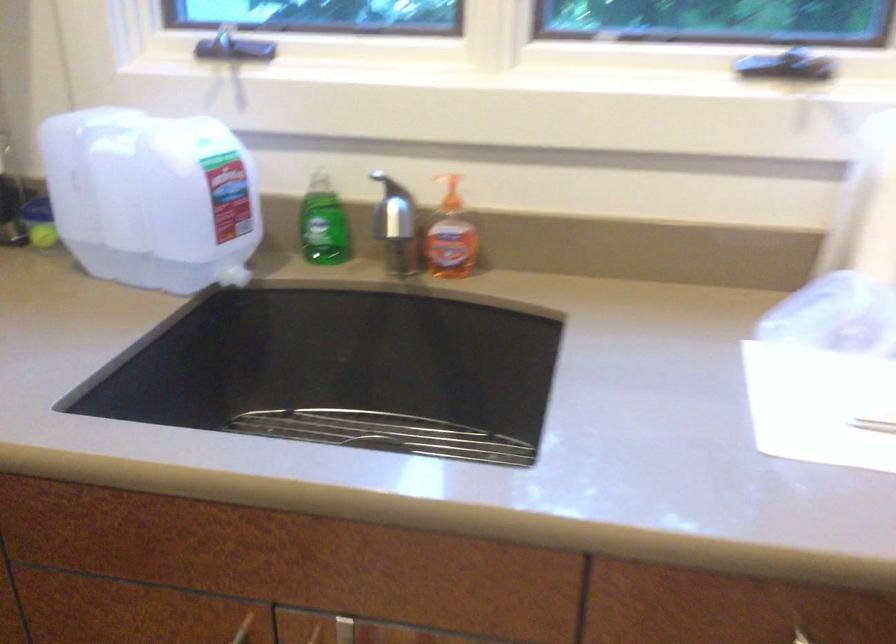
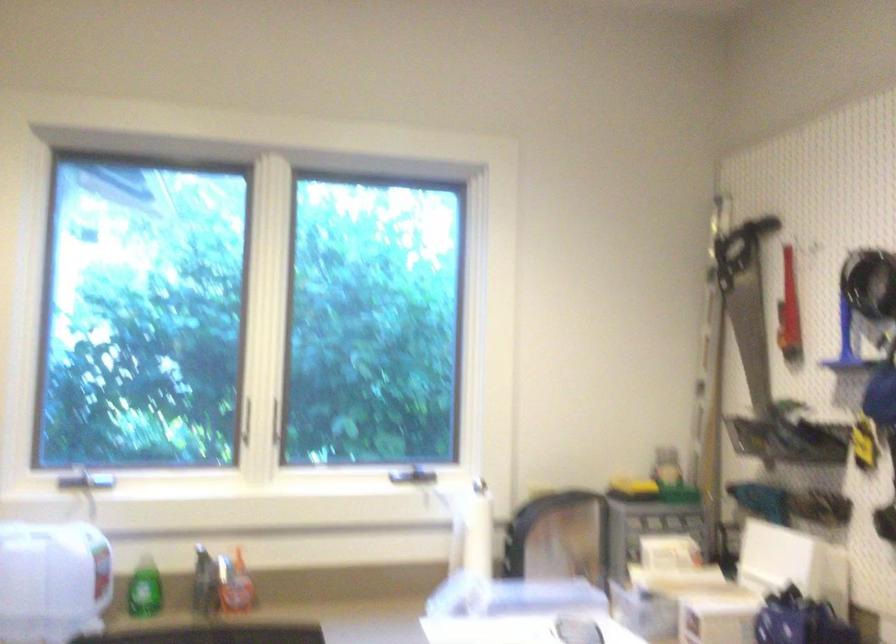
In the second image, find the point that corresponds to (444,234) in the first image.

(234, 583)